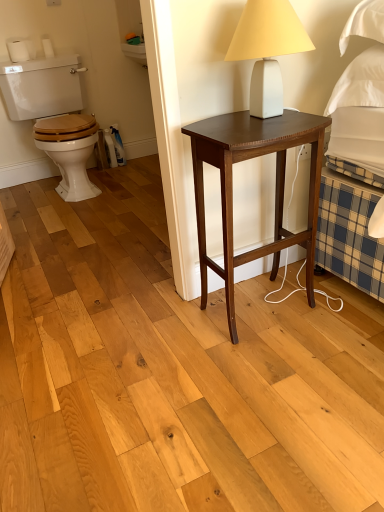
Where is `vacant space situated on the left part of dark wood nightstand at center`? This screenshot has height=512, width=384. vacant space situated on the left part of dark wood nightstand at center is located at coordinates coord(179,334).